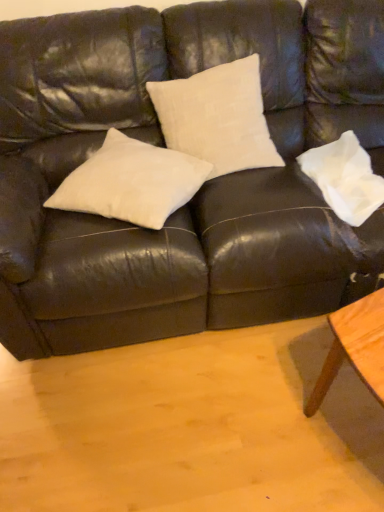
Question: Is point (337, 169) positioned closer to the camera than point (102, 210)?

Choices:
 (A) farther
 (B) closer

Answer: (A)

Question: Is white cotton pillow at right, marked as the 1th pillow in a right-to-left arrangement, bigger or smaller than white cotton pillow at center, placed as the 2th pillow when sorted from right to left?

Choices:
 (A) small
 (B) big

Answer: (A)

Question: Which of these objects is positioned closest to the white cotton pillow at center, the first pillow in the left-to-right sequence?

Choices:
 (A) matte black leather couch at center
 (B) white cotton pillow at right, the 2th pillow viewed from the left

Answer: (A)

Question: Which object is the farthest from the white cotton pillow at center, the first pillow in the left-to-right sequence?

Choices:
 (A) white cotton pillow at right, the 2th pillow viewed from the left
 (B) matte black leather couch at center

Answer: (A)